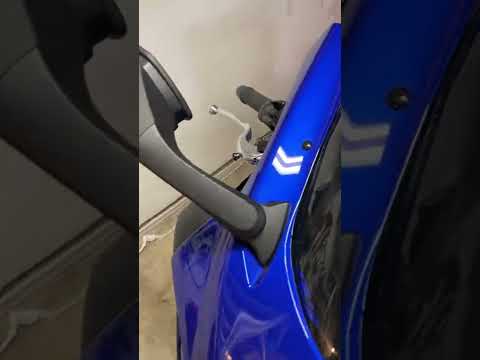
At what (x,y) coordinates should I click in order to perform the action: click on white wall. Please return your answer as a coordinate pair (x, y). Looking at the image, I should click on (192, 78).